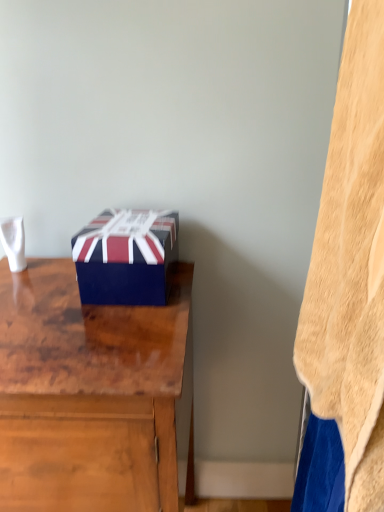
Describe the element at coordinates (126, 257) in the screenshot. Image resolution: width=384 pixels, height=512 pixels. I see `blue glossy box at center` at that location.

Where is `wooden desk at center`? This screenshot has height=512, width=384. wooden desk at center is located at coordinates (88, 394).

Where is `beige fleece blanket at right`? Image resolution: width=384 pixels, height=512 pixels. beige fleece blanket at right is located at coordinates (351, 267).

How much distance is there between blue glossy box at center and wooden desk at center?

They are 6.34 inches apart.

Locate an element on the screen. This screenshot has width=384, height=512. desk below the blue glossy box at center (from a real-world perspective) is located at coordinates (88, 394).

Between blue glossy box at center and wooden desk at center, which one has less height?

blue glossy box at center.

From a real-world perspective, does blue glossy box at center sit lower than beige fleece blanket at right?

Yes, from a real-world perspective, blue glossy box at center is beneath beige fleece blanket at right.

Which is behind, point (109, 285) or point (316, 238)?

The point (109, 285) is more distant.

Considering the relative sizes of blue glossy box at center and beige fleece blanket at right in the image provided, is blue glossy box at center shorter than beige fleece blanket at right?

Correct, blue glossy box at center is not as tall as beige fleece blanket at right.

At what (x,y) coordinates should I click in order to perform the action: click on blanket in front of the blue glossy box at center. Please return your answer as a coordinate pair (x, y). This screenshot has width=384, height=512. Looking at the image, I should click on (351, 267).

Is point (308, 346) more distant than point (133, 300)?

No, it is not.

Are beige fleece blanket at right and blue glossy box at center far apart?

beige fleece blanket at right is near blue glossy box at center, not far away.

Can you tell me how much beige fleece blanket at right and wooden desk at center differ in facing direction?

88.9 degrees.

In the image, there is a beige fleece blanket at right. Where is `desk below it (from a real-world perspective)`? desk below it (from a real-world perspective) is located at coordinates (88, 394).

Are beige fleece blanket at right and wooden desk at center located far from each other?

No, beige fleece blanket at right is not far from wooden desk at center.

Which of these two, beige fleece blanket at right or wooden desk at center, is smaller?

beige fleece blanket at right is smaller.

Who is taller, wooden desk at center or beige fleece blanket at right?

wooden desk at center.

Is wooden desk at center at the left side of beige fleece blanket at right?

Yes, wooden desk at center is to the left of beige fleece blanket at right.

Is wooden desk at center positioned far away from beige fleece blanket at right?

That's not correct — wooden desk at center is a little close to beige fleece blanket at right.

From the picture: Choose the correct answer: Is wooden desk at center inside beige fleece blanket at right or outside it?

wooden desk at center cannot be found inside beige fleece blanket at right.

Could you tell me if wooden desk at center is turned towards blue glossy box at center?

No, wooden desk at center does not turn towards blue glossy box at center.

From the picture: Considering the sizes of objects wooden desk at center and blue glossy box at center in the image provided, who is thinner, wooden desk at center or blue glossy box at center?

blue glossy box at center is thinner.

Considering the positions of objects wooden desk at center and blue glossy box at center in the image provided, who is behind, wooden desk at center or blue glossy box at center?

blue glossy box at center.

Where is `desk below the blue glossy box at center (from the image's perspective)`? The width and height of the screenshot is (384, 512). desk below the blue glossy box at center (from the image's perspective) is located at coordinates (x=88, y=394).

Where is `blanket positioned vertically above the blue glossy box at center (from a real-world perspective)`? The width and height of the screenshot is (384, 512). blanket positioned vertically above the blue glossy box at center (from a real-world perspective) is located at coordinates (351, 267).

In the scene shown: Which object lies nearer to the anchor point blue glossy box at center, beige fleece blanket at right or wooden desk at center?

wooden desk at center is positioned closer to the anchor blue glossy box at center.

Estimate the real-world distances between objects in this image. Which object is further from wooden desk at center, beige fleece blanket at right or blue glossy box at center?

Among the two, beige fleece blanket at right is located further to wooden desk at center.

Estimate the real-world distances between objects in this image. Which object is closer to blue glossy box at center, wooden desk at center or beige fleece blanket at right?

Based on the image, wooden desk at center appears to be nearer to blue glossy box at center.

Based on their spatial positions, is wooden desk at center or blue glossy box at center further from beige fleece blanket at right?

blue glossy box at center is further to beige fleece blanket at right.

From the image, which object appears to be nearer to beige fleece blanket at right, blue glossy box at center or wooden desk at center?

wooden desk at center is positioned closer to the anchor beige fleece blanket at right.

Which object lies nearer to the anchor point wooden desk at center, blue glossy box at center or beige fleece blanket at right?

The object closer to wooden desk at center is blue glossy box at center.

The image size is (384, 512). In order to click on desk between beige fleece blanket at right and blue glossy box at center along the z-axis in this screenshot , I will do `click(88, 394)`.